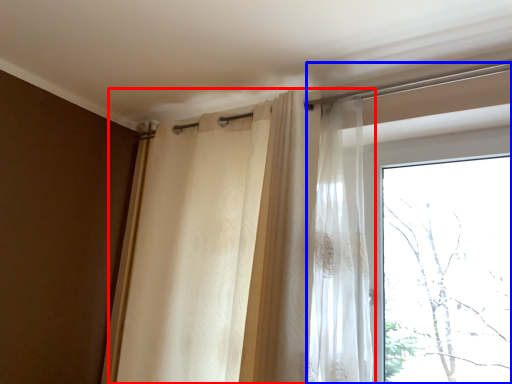
Question: Which of the following is the closest to the observer, curtain (highlighted by a red box) or window (highlighted by a blue box)?

Choices:
 (A) curtain
 (B) window

Answer: (A)